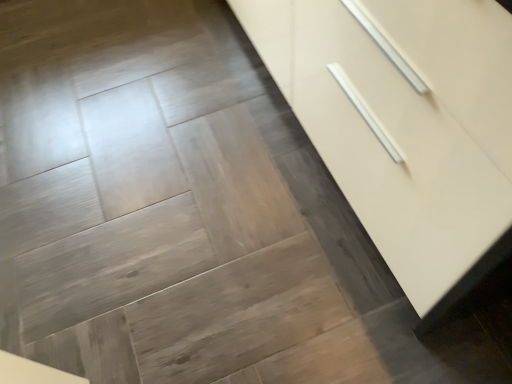
Measure the distance between white glossy cabinet at center and camera.

white glossy cabinet at center and camera are 20.00 inches apart from each other.

Locate an element on the screen. This screenshot has width=512, height=384. white glossy cabinet at center is located at coordinates (404, 122).

The image size is (512, 384). Describe the element at coordinates (404, 122) in the screenshot. I see `white glossy cabinet at center` at that location.

Find the location of a particular element. The height and width of the screenshot is (384, 512). white glossy cabinet at center is located at coordinates (404, 122).